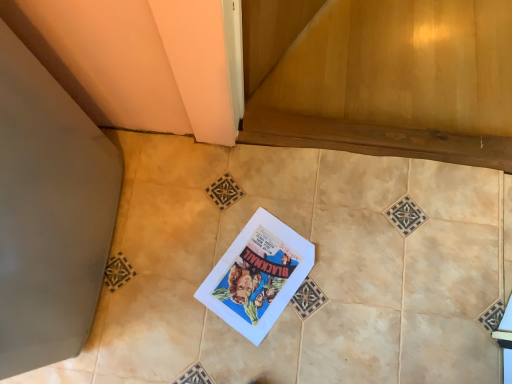
The width and height of the screenshot is (512, 384). Identify the location of vacant space behind matte paper comic book at center. (264, 194).